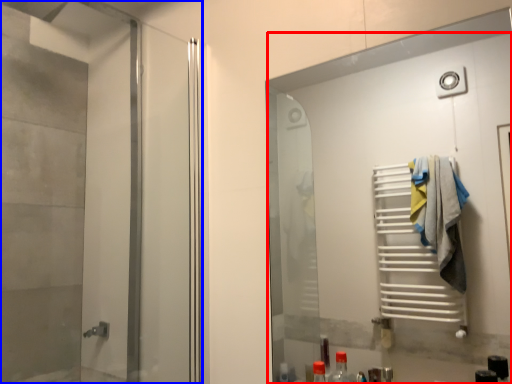
Question: Which object appears farthest to the camera in this image, door (highlighted by a red box) or elevator (highlighted by a blue box)?

Choices:
 (A) door
 (B) elevator

Answer: (B)